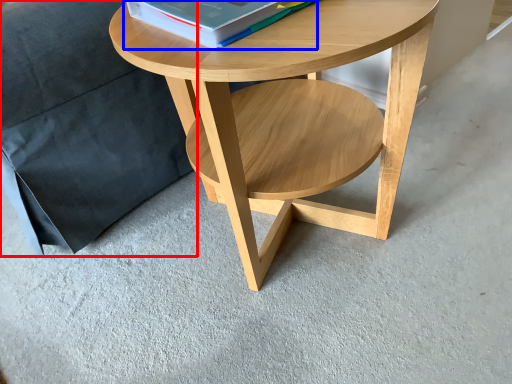
Question: Among these objects, which one is farthest to the camera, pillow (highlighted by a red box) or paperback book (highlighted by a blue box)?

Choices:
 (A) pillow
 (B) paperback book

Answer: (A)